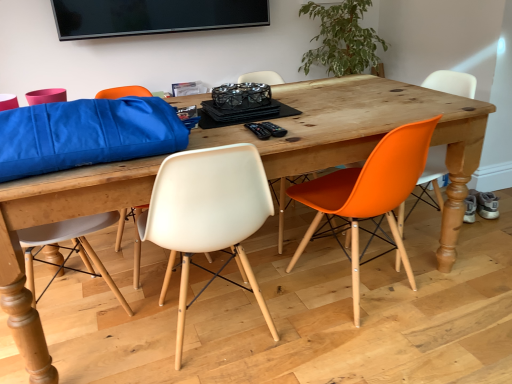
Find the location of a particular element. The image size is (512, 384). vacant space to the right of black plastic remote control at center, which is the 2th remote control in right-to-left order is located at coordinates (304, 129).